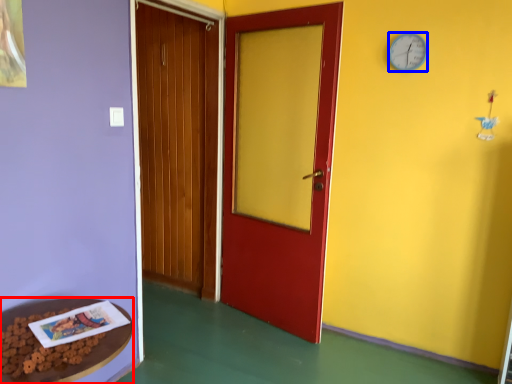
Question: Which object is further to the camera taking this photo, table (highlighted by a red box) or clock (highlighted by a blue box)?

Choices:
 (A) table
 (B) clock

Answer: (B)